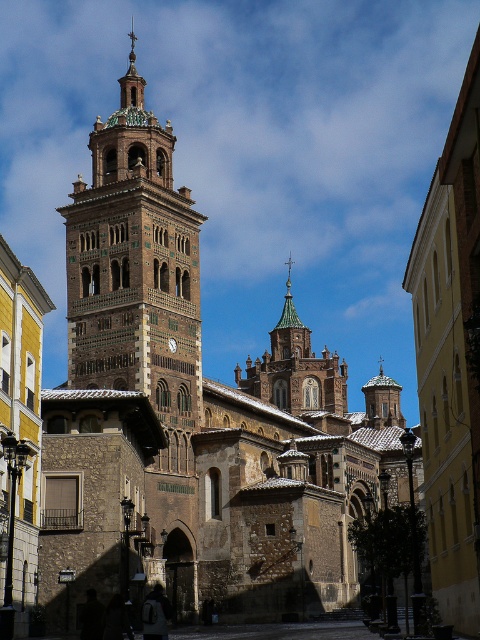
Does green copper spire at center have a smaller size compared to gold textured spire at upper center?

Correct, green copper spire at center occupies less space than gold textured spire at upper center.

Does green copper spire at center have a greater height compared to gold textured spire at upper center?

Incorrect, green copper spire at center's height is not larger of gold textured spire at upper center's.

Is point (288, 294) farther from camera compared to point (141, 76)?

Yes, it is behind point (141, 76).

The height and width of the screenshot is (640, 480). I want to click on green copper spire at center, so click(x=289, y=330).